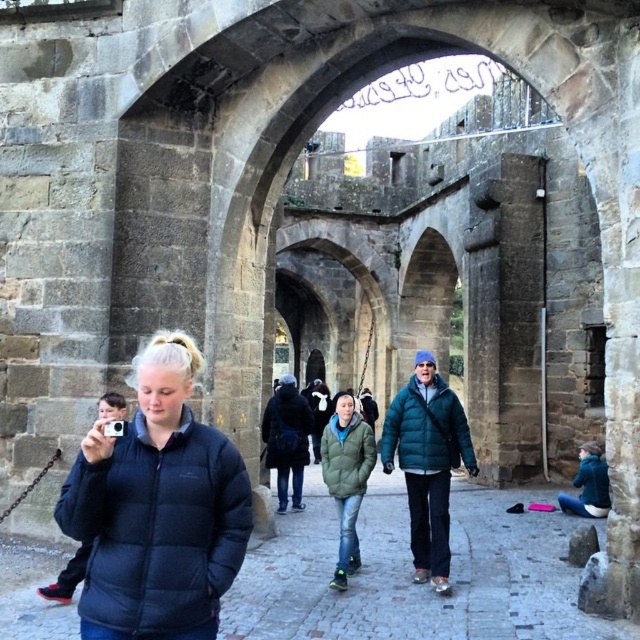
Question: Does teal puffer jacket at center appear on the right side of teal fleece jacket at lower right?

Choices:
 (A) yes
 (B) no

Answer: (B)

Question: Is matte black jacket at left bigger than green matte jacket at center?

Choices:
 (A) yes
 (B) no

Answer: (A)

Question: Estimate the real-world distances between objects in this image. Which object is farther from the green matte jacket at center?

Choices:
 (A) teal fleece jacket at lower right
 (B) teal puffer jacket at center

Answer: (A)

Question: Which point is closer to the camera?

Choices:
 (A) (582, 492)
 (B) (410, 444)
 (C) (144, 524)
 (D) (326, 468)

Answer: (C)

Question: Which object appears closest to the camera in this image?

Choices:
 (A) teal puffer jacket at center
 (B) green matte jacket at center

Answer: (A)

Question: Is matte black jacket at left thinner than teal fleece jacket at lower right?

Choices:
 (A) yes
 (B) no

Answer: (B)